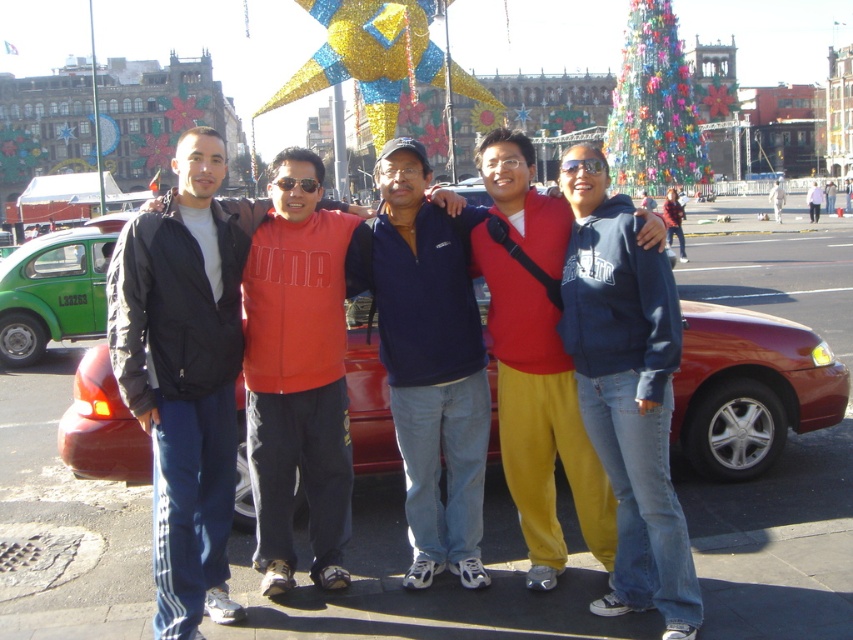
You are a photographer trying to capture a photo of the group while ensuring the green matte taxi at left and the white matte jacket at center are both in the frame. Based on their positions, which object is closer to the left edge of the photo?

The green matte taxi at left is closer to the left edge of the photo because it is positioned to the left of the white matte jacket at center.